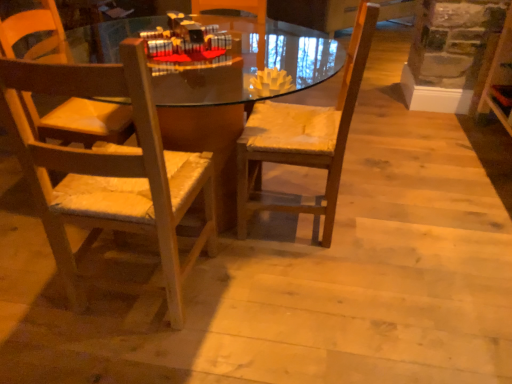
Identify the location of matte wood desk at center. The height and width of the screenshot is (384, 512). (209, 79).

What do you see at coordinates (304, 137) in the screenshot?
I see `wooden chair at center, the 1th chair from the right` at bounding box center [304, 137].

Where is `matte wood desk at center`? The height and width of the screenshot is (384, 512). matte wood desk at center is located at coordinates (209, 79).

Considering the relative positions of wooden chair at center, the 1th chair from the right, and matte wood desk at center in the image provided, is wooden chair at center, the 1th chair from the right, behind matte wood desk at center?

Yes, wooden chair at center, the 1th chair from the right, is further from the viewer.

Does wooden chair at center, which is the 2th chair from left to right, have a greater width compared to matte wood desk at center?

No.

Is the surface of wooden chair at center, the 1th chair from the right, in direct contact with matte wood desk at center?

wooden chair at center, the 1th chair from the right, is not next to matte wood desk at center, and they're not touching.

Considering the positions of point (145, 109) and point (268, 150), is point (145, 109) closer or farther from the camera than point (268, 150)?

Point (145, 109).

Looking at this image, is wooden chair with woven seat cushion at left, the second chair positioned from the right, inside the boundaries of wooden chair at center, the 1th chair from the right, or outside?

wooden chair with woven seat cushion at left, the second chair positioned from the right, cannot be found inside wooden chair at center, the 1th chair from the right.

Considering the relative sizes of wooden chair with woven seat cushion at left, the second chair positioned from the right, and wooden chair at center, the 1th chair from the right, in the image provided, is wooden chair with woven seat cushion at left, the second chair positioned from the right, smaller than wooden chair at center, the 1th chair from the right,?

No, wooden chair with woven seat cushion at left, the second chair positioned from the right, is not smaller than wooden chair at center, the 1th chair from the right.

Can you tell me how much wooden chair with woven seat cushion at left, the 1th chair when ordered from left to right, and wooden chair at center, the 1th chair from the right, differ in facing direction?

wooden chair with woven seat cushion at left, the 1th chair when ordered from left to right, and wooden chair at center, the 1th chair from the right, are facing 90.5 degrees away from each other.

Between wooden chair at center, which is the 2th chair from left to right, and wooden chair with woven seat cushion at left, the second chair positioned from the right, which one has less height?

With less height is wooden chair with woven seat cushion at left, the second chair positioned from the right.

Is wooden chair at center, which is the 2th chair from left to right, beside wooden chair with woven seat cushion at left, the 1th chair when ordered from left to right?

No, wooden chair at center, which is the 2th chair from left to right, is not making contact with wooden chair with woven seat cushion at left, the 1th chair when ordered from left to right.

In the scene shown: From a real-world perspective, which object rests below the other?

wooden chair at center, which is the 2th chair from left to right, is physically lower.

Is matte wood desk at center positioned with its back to wooden chair at center, which is the 2th chair from left to right?

matte wood desk at center is not turned away from wooden chair at center, which is the 2th chair from left to right.

Considering the positions of objects matte wood desk at center and wooden chair at center, the 1th chair from the right, in the image provided, who is more to the left, matte wood desk at center or wooden chair at center, the 1th chair from the right,?

From the viewer's perspective, matte wood desk at center appears more on the left side.

From a real-world perspective, which object stands above the other?

wooden chair at center, the 1th chair from the right, is physically above.

Which is behind, matte wood desk at center or wooden chair at center, the 1th chair from the right?

Positioned behind is wooden chair at center, the 1th chair from the right.

In the image, is wooden chair with woven seat cushion at left, the 1th chair when ordered from left to right, positioned in front of or behind matte wood desk at center?

Clearly, wooden chair with woven seat cushion at left, the 1th chair when ordered from left to right, is in front of matte wood desk at center.

Is matte wood desk at center completely or partially inside wooden chair with woven seat cushion at left, the second chair positioned from the right?

No, matte wood desk at center is not inside wooden chair with woven seat cushion at left, the second chair positioned from the right.

Considering the relative sizes of wooden chair with woven seat cushion at left, the 1th chair when ordered from left to right, and matte wood desk at center in the image provided, is wooden chair with woven seat cushion at left, the 1th chair when ordered from left to right, thinner than matte wood desk at center?

Indeed, wooden chair with woven seat cushion at left, the 1th chair when ordered from left to right, has a lesser width compared to matte wood desk at center.

From a real-world perspective, is wooden chair with woven seat cushion at left, the 1th chair when ordered from left to right, above or below matte wood desk at center?

Clearly, from a real-world perspective, wooden chair with woven seat cushion at left, the 1th chair when ordered from left to right, is above matte wood desk at center.

Which object is wider, matte wood desk at center or wooden chair with woven seat cushion at left, the second chair positioned from the right?

matte wood desk at center.

From a real-world perspective, between matte wood desk at center and wooden chair with woven seat cushion at left, the 1th chair when ordered from left to right, who is vertically higher?

In real-world perspective, wooden chair with woven seat cushion at left, the 1th chair when ordered from left to right, is above.

Locate an element on the screen. The height and width of the screenshot is (384, 512). chair that appears below the matte wood desk at center (from the image's perspective) is located at coordinates (109, 170).

What's the angular difference between matte wood desk at center and wooden chair with woven seat cushion at left, the 1th chair when ordered from left to right,'s facing directions?

0.189 degrees separate the facing orientations of matte wood desk at center and wooden chair with woven seat cushion at left, the 1th chair when ordered from left to right.

You are a GUI agent. You are given a task and a screenshot of the screen. Output one action in this format:
    pyautogui.click(x=<x>, y=<y>)
    Task: Click on the chair on the right of matte wood desk at center
    Image resolution: width=512 pixels, height=384 pixels.
    Given the screenshot: What is the action you would take?
    pyautogui.click(x=304, y=137)

Where is `chair on the left side of wooden chair at center, which is the 2th chair from left to right`? Image resolution: width=512 pixels, height=384 pixels. chair on the left side of wooden chair at center, which is the 2th chair from left to right is located at coordinates (109, 170).

From the image, which object appears to be nearer to wooden chair with woven seat cushion at left, the second chair positioned from the right, wooden chair at center, which is the 2th chair from left to right, or matte wood desk at center?

wooden chair at center, which is the 2th chair from left to right, is closer to wooden chair with woven seat cushion at left, the second chair positioned from the right.

Estimate the real-world distances between objects in this image. Which object is closer to wooden chair at center, the 1th chair from the right, matte wood desk at center or wooden chair with woven seat cushion at left, the second chair positioned from the right?

wooden chair with woven seat cushion at left, the second chair positioned from the right, is positioned closer to the anchor wooden chair at center, the 1th chair from the right.

Estimate the real-world distances between objects in this image. Which object is closer to matte wood desk at center, wooden chair with woven seat cushion at left, the second chair positioned from the right, or wooden chair at center, the 1th chair from the right?

wooden chair at center, the 1th chair from the right, is closer to matte wood desk at center.

When comparing their distances from wooden chair with woven seat cushion at left, the second chair positioned from the right, does matte wood desk at center or wooden chair at center, which is the 2th chair from left to right, seem closer?

wooden chair at center, which is the 2th chair from left to right, is positioned closer to the anchor wooden chair with woven seat cushion at left, the second chair positioned from the right.

Looking at the image, which one is located further to matte wood desk at center, wooden chair at center, which is the 2th chair from left to right, or wooden chair with woven seat cushion at left, the second chair positioned from the right?

wooden chair with woven seat cushion at left, the second chair positioned from the right, is further to matte wood desk at center.

In the scene shown: Estimate the real-world distances between objects in this image. Which object is closer to wooden chair at center, which is the 2th chair from left to right, wooden chair with woven seat cushion at left, the second chair positioned from the right, or matte wood desk at center?

Based on the image, wooden chair with woven seat cushion at left, the second chair positioned from the right, appears to be nearer to wooden chair at center, which is the 2th chair from left to right.

This screenshot has height=384, width=512. Identify the location of desk situated between wooden chair with woven seat cushion at left, the 1th chair when ordered from left to right, and wooden chair at center, which is the 2th chair from left to right, from left to right. (209, 79).